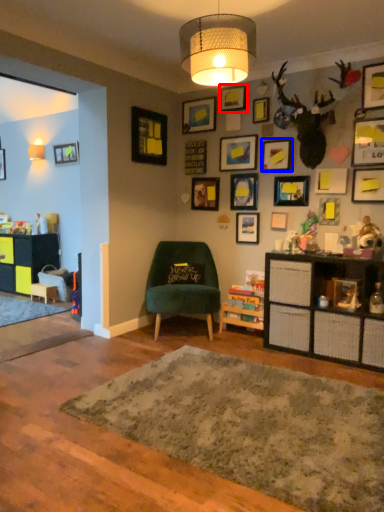
Question: Among these objects, which one is nearest to the camera, picture frame (highlighted by a red box) or picture frame (highlighted by a blue box)?

Choices:
 (A) picture frame
 (B) picture frame

Answer: (B)